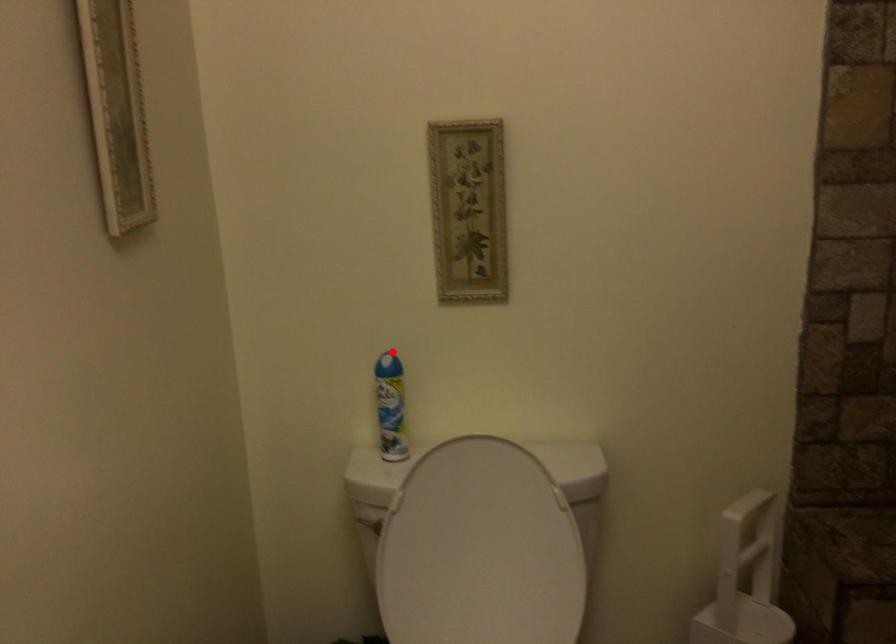
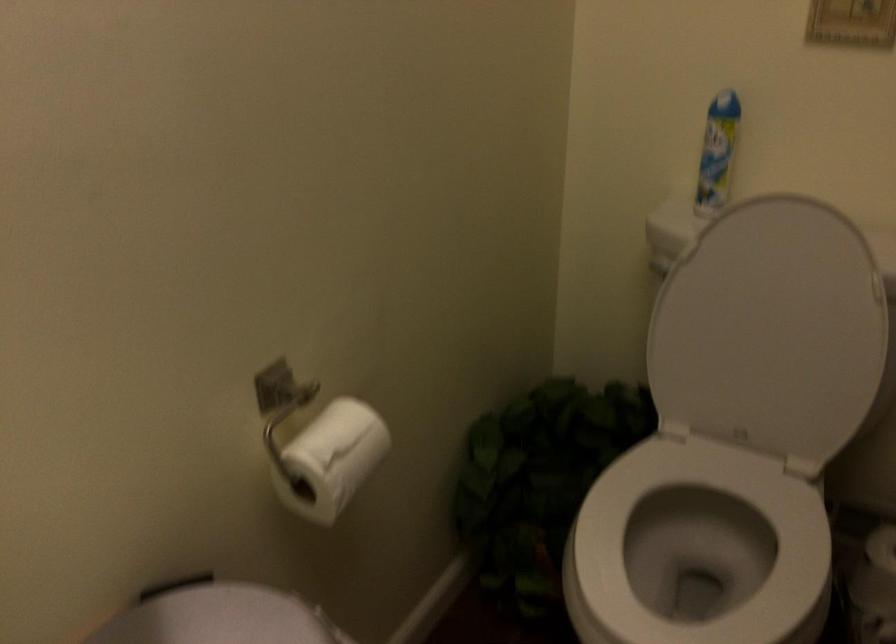
Locate, in the second image, the point that corresponds to the highlighted location in the first image.

(729, 96)